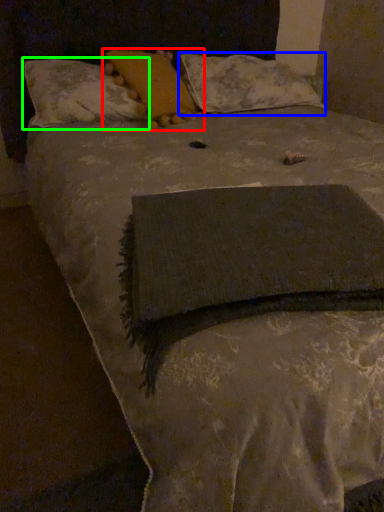
Question: Which object is positioned farthest from pillow (highlighted by a red box)? Select from pillow (highlighted by a blue box) and pillow (highlighted by a green box).

Choices:
 (A) pillow
 (B) pillow

Answer: (A)